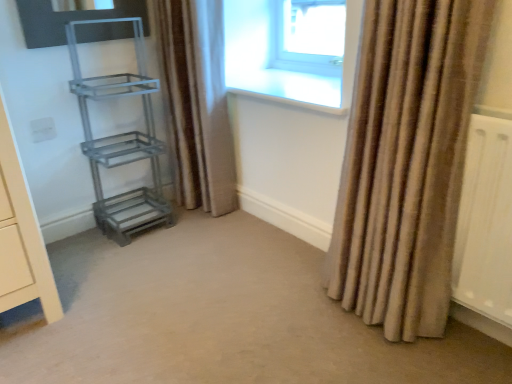
Locate an element on the screen. The width and height of the screenshot is (512, 384). free spot in front of metallic gray shelf at lower left, the first shelf positioned from the bottom is located at coordinates (110, 256).